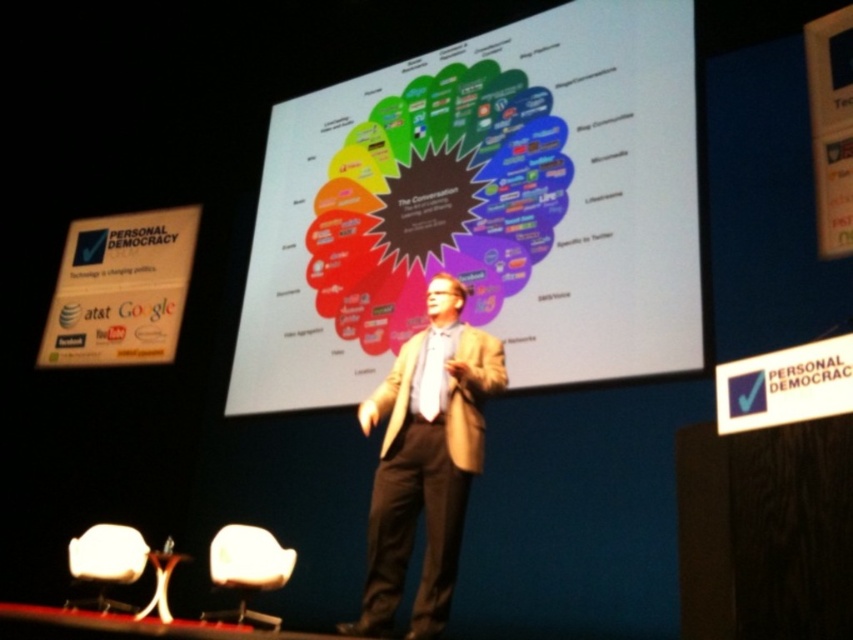
Can you confirm if tan fabric suit at center is positioned above white plastic chair at lower left?

Yes, tan fabric suit at center is above white plastic chair at lower left.

Consider the image. Is tan fabric suit at center wider than white plastic chair at lower left?

Correct, the width of tan fabric suit at center exceeds that of white plastic chair at lower left.

Is point (416, 372) farther from camera compared to point (93, 605)?

No, it is in front of (93, 605).

Locate an element on the screen. This screenshot has height=640, width=853. tan fabric suit at center is located at coordinates (425, 460).

Who is more distant from viewer, [486,360] or [231,579]?

Positioned behind is point [231,579].

Image resolution: width=853 pixels, height=640 pixels. In order to click on tan fabric suit at center in this screenshot , I will do `click(425, 460)`.

What do you see at coordinates (485, 209) in the screenshot?
I see `white matte projection screen at center` at bounding box center [485, 209].

Does white matte projection screen at center have a greater height compared to white fabric chair at lower left?

Yes.

Describe the element at coordinates (485, 209) in the screenshot. This screenshot has width=853, height=640. I see `white matte projection screen at center` at that location.

I want to click on white matte projection screen at center, so click(485, 209).